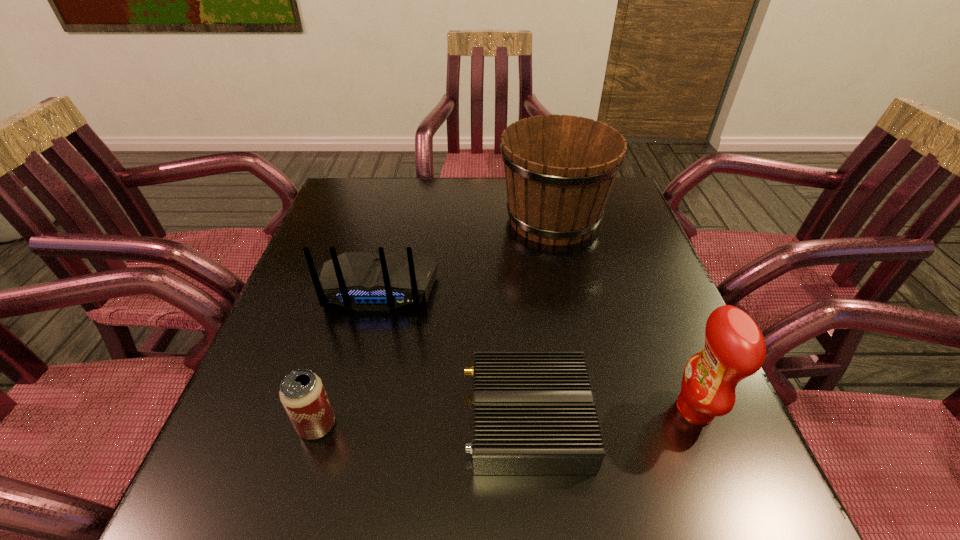
What are the coordinates of `vacant area situated on the label side of the condiment` in the screenshot? It's located at [598, 409].

At what (x,y) coordinates should I click in order to perform the action: click on blank area located on the back of the taller router. Please return your answer as a coordinate pair (x, y). The width and height of the screenshot is (960, 540). Looking at the image, I should click on (364, 348).

Where is `vacant space located on the right of the beer can`? Image resolution: width=960 pixels, height=540 pixels. vacant space located on the right of the beer can is located at coordinates (387, 426).

The width and height of the screenshot is (960, 540). Find the location of `blank space located 0.170m on the back panel of the right router`. blank space located 0.170m on the back panel of the right router is located at coordinates (369, 420).

Where is `blank space located on the back panel of the right router`? This screenshot has width=960, height=540. blank space located on the back panel of the right router is located at coordinates (358, 420).

Locate an element on the screen. This screenshot has width=960, height=540. vacant area situated on the back panel of the right router is located at coordinates (313, 420).

You are a GUI agent. You are given a task and a screenshot of the screen. Output one action in this format:
    pyautogui.click(x=<x>, y=<y>)
    Task: Click on the object present at the far edge
    The height and width of the screenshot is (540, 960).
    Given the screenshot: What is the action you would take?
    pyautogui.click(x=559, y=170)

Find the location of a particular element. This screenshot has width=960, height=540. object that is at the near edge is located at coordinates (533, 411).

Where is `router that is positioned at the left edge`? The image size is (960, 540). router that is positioned at the left edge is located at coordinates (363, 281).

This screenshot has height=540, width=960. I want to click on beer can present at the left edge, so click(302, 394).